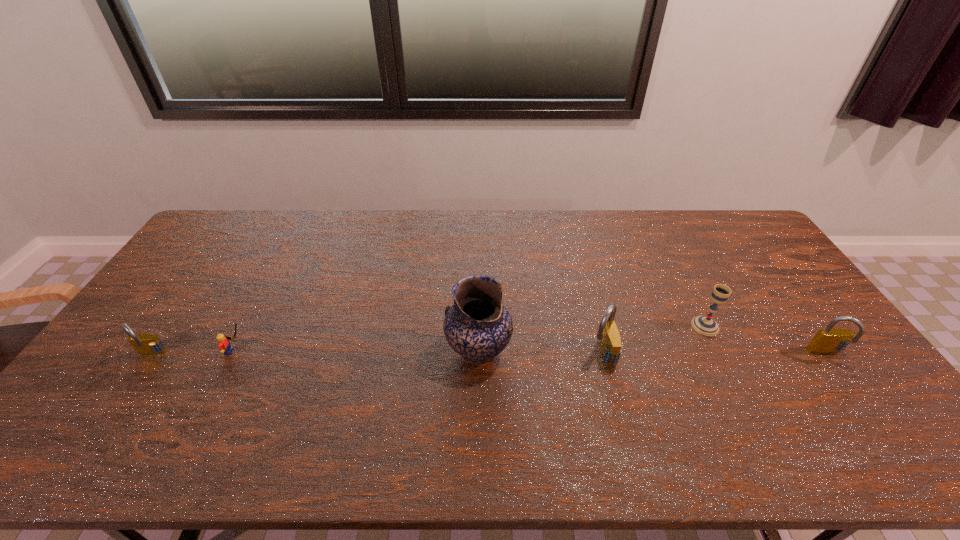
You are a GUI agent. You are given a task and a screenshot of the screen. Output one action in this format:
    pyautogui.click(x=<x>, y=<y>)
    Task: Click on the empty location between the second padlock from left to right and the pottery
    The image size is (960, 540).
    Given the screenshot: What is the action you would take?
    pyautogui.click(x=540, y=353)

Locate an element on the screen. The height and width of the screenshot is (540, 960). unoccupied position between the shortest object and the fourth object from left to right is located at coordinates (419, 353).

What are the coordinates of `empty space that is in between the pottery and the second padlock from right to left` in the screenshot? It's located at (540, 353).

The height and width of the screenshot is (540, 960). What are the coordinates of `object identified as the second closest to the chalice` in the screenshot? It's located at (610, 344).

Locate which object ranks fifth in proximity to the second shortest padlock. Please provide its 2D coordinates. Your answer should be formatted as a tuple, i.e. [(x, y)], where the tuple contains the x and y coordinates of a point satisfying the conditions above.

[(146, 344)]

Locate an element on the screen. The height and width of the screenshot is (540, 960). padlock that is the second closest to the second tallest padlock is located at coordinates (146, 344).

Locate which padlock is the closest to the leftmost padlock. Please provide its 2D coordinates. Your answer should be formatted as a tuple, i.e. [(x, y)], where the tuple contains the x and y coordinates of a point satisfying the conditions above.

[(610, 344)]

Locate an element on the screen. This screenshot has height=540, width=960. free space in the image that satisfies the following two spatial constraints: 1. on the side with the combination dials of the rightmost padlock; 2. on the side with the combination dials of the second padlock from left to right is located at coordinates (827, 354).

Where is `vacant space that satisfies the following two spatial constraints: 1. on the side with the combination dials of the second padlock from left to right; 2. on the side with the combination dials of the leftmost object`? The width and height of the screenshot is (960, 540). vacant space that satisfies the following two spatial constraints: 1. on the side with the combination dials of the second padlock from left to right; 2. on the side with the combination dials of the leftmost object is located at coordinates (x=602, y=355).

Where is `blank space that satisfies the following two spatial constraints: 1. on the back side of the tallest object; 2. on the left side of the second object from right to left`? This screenshot has height=540, width=960. blank space that satisfies the following two spatial constraints: 1. on the back side of the tallest object; 2. on the left side of the second object from right to left is located at coordinates (478, 326).